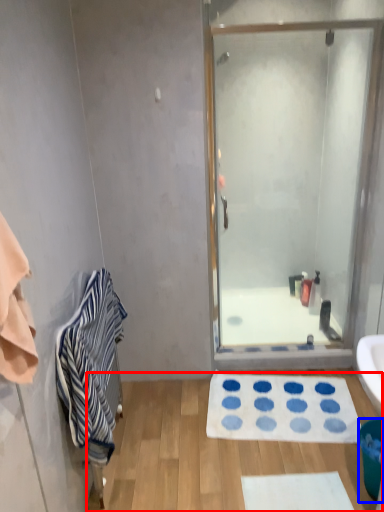
Question: Which object appears farthest to the camera in this image, plain (highlighted by a red box) or trash bin/can (highlighted by a blue box)?

Choices:
 (A) plain
 (B) trash bin/can

Answer: (A)